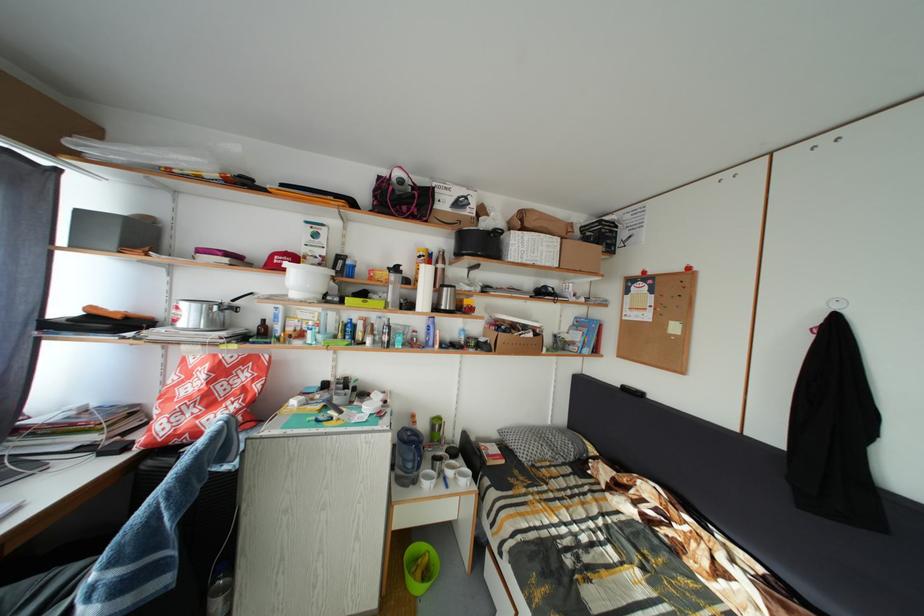
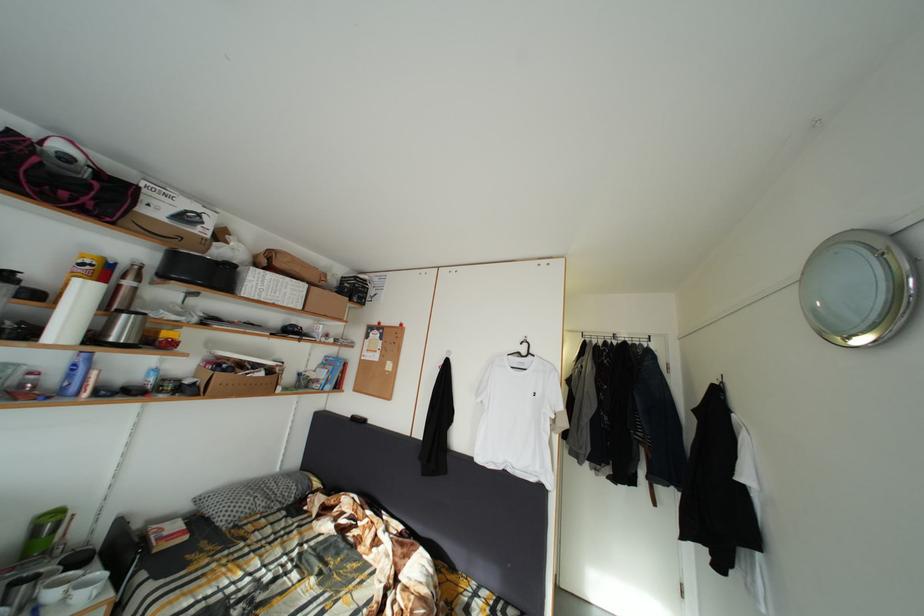
Locate, in the second image, the point that corresponds to pixel 533 334 in the first image.

(264, 373)